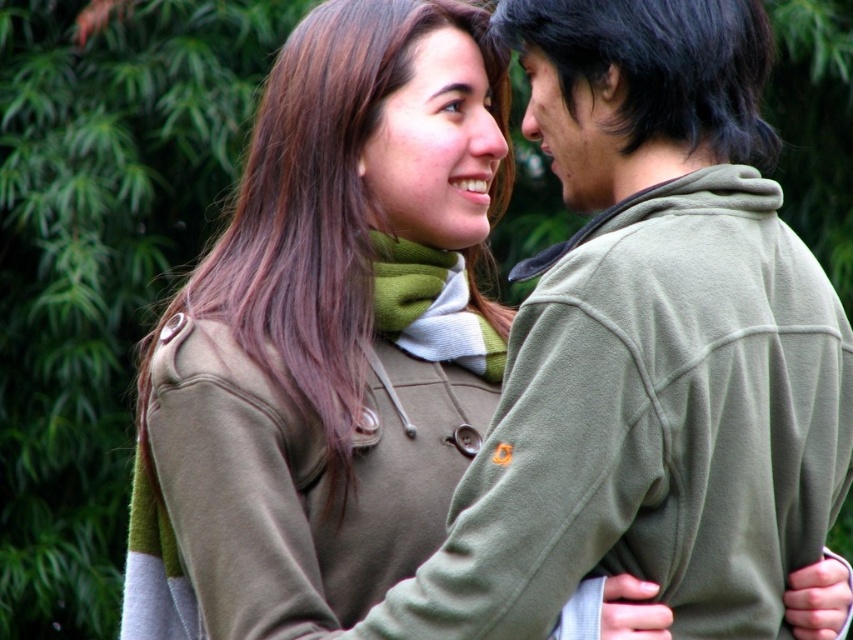
Does green leafy tree at upper left appear on the right side of olive green fleece at upper right?

Incorrect, green leafy tree at upper left is not on the right side of olive green fleece at upper right.

Is green leafy tree at upper left bigger than olive green fleece at upper right?

Correct, green leafy tree at upper left is larger in size than olive green fleece at upper right.

Image resolution: width=853 pixels, height=640 pixels. Describe the element at coordinates (102, 262) in the screenshot. I see `green leafy tree at upper left` at that location.

Image resolution: width=853 pixels, height=640 pixels. What are the coordinates of `green leafy tree at upper left` in the screenshot? It's located at point(102,262).

Is olive green fleece at upper right to the left of matte olive green forehead at upper center from the viewer's perspective?

In fact, olive green fleece at upper right is to the right of matte olive green forehead at upper center.

Can you confirm if olive green fleece at upper right is wider than matte olive green forehead at upper center?

Correct, the width of olive green fleece at upper right exceeds that of matte olive green forehead at upper center.

Does point (611, 38) lie behind point (415, 77)?

No, (611, 38) is closer to viewer.

Identify the location of olive green fleece at upper right. (x=659, y=67).

Does green leafy tree at upper left appear under matte olive green forehead at upper center?

Yes.

Is green leafy tree at upper left wider than matte olive green forehead at upper center?

Yes, green leafy tree at upper left is wider than matte olive green forehead at upper center.

This screenshot has height=640, width=853. Identify the location of green leafy tree at upper left. (102, 262).